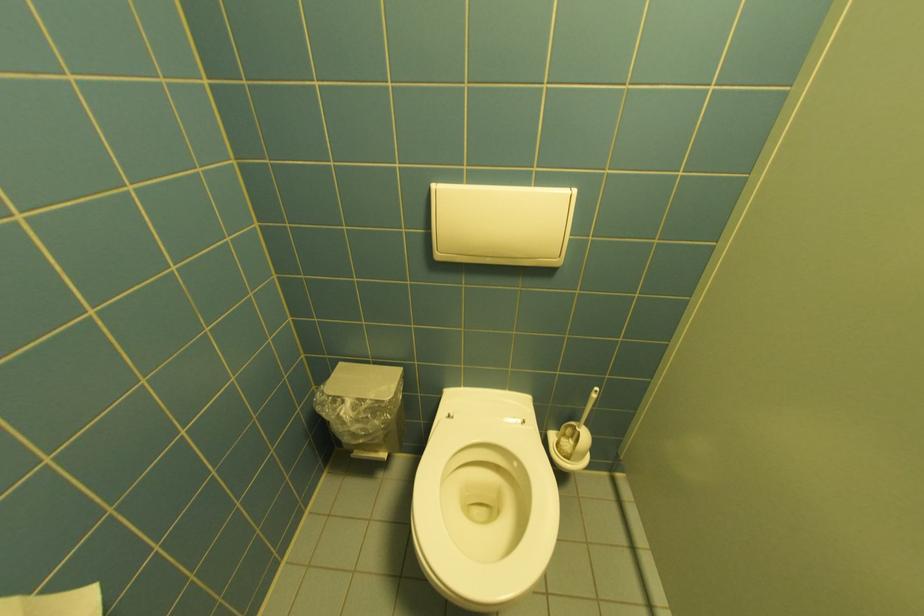
What do you see at coordinates (483, 500) in the screenshot?
I see `a white toilet lid` at bounding box center [483, 500].